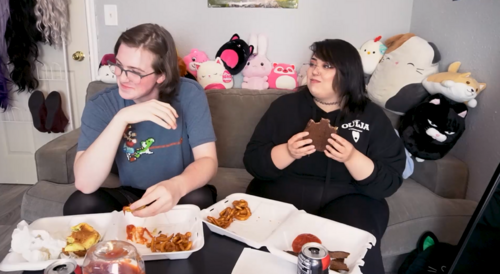
I want to click on food container, so click(x=270, y=223), click(x=119, y=229).